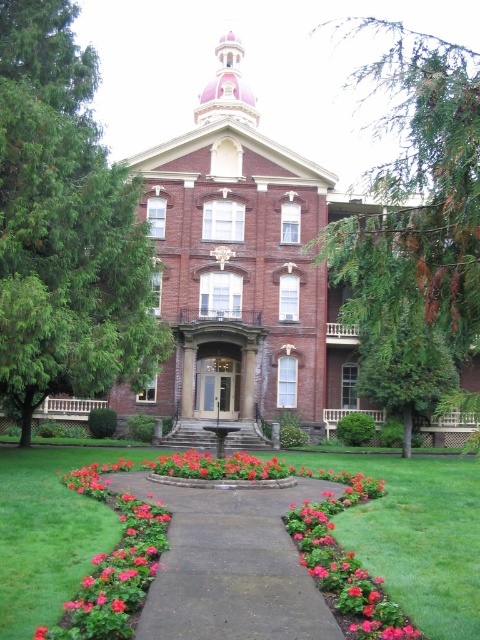
Does pink matte flower bed at center appear on the left side of smooth glossy flower at center?

Incorrect, pink matte flower bed at center is not on the left side of smooth glossy flower at center.

Describe the element at coordinates (217, 468) in the screenshot. I see `pink matte flower bed at center` at that location.

The width and height of the screenshot is (480, 640). I want to click on pink matte flower bed at center, so click(217, 468).

Between green leafy tree at upper right and pink matte flower bed at center, which one is positioned lower?

pink matte flower bed at center is below.

Which is above, green leafy tree at upper right or pink matte flower bed at center?

green leafy tree at upper right is above.

Which is in front, point (428, 227) or point (286, 484)?

Point (428, 227)

This screenshot has width=480, height=640. In order to click on green leafy tree at upper right in this screenshot , I will do `click(418, 188)`.

Who is positioned more to the right, green leafy tree at left or pink matte flower bed at center?

pink matte flower bed at center is more to the right.

Between point (37, 209) and point (219, 474), which one is positioned in front?

Point (37, 209)

Does point (47, 209) come farther from viewer compared to point (247, 472)?

No, it is not.

Where is `green leafy tree at left`? green leafy tree at left is located at coordinates (64, 225).